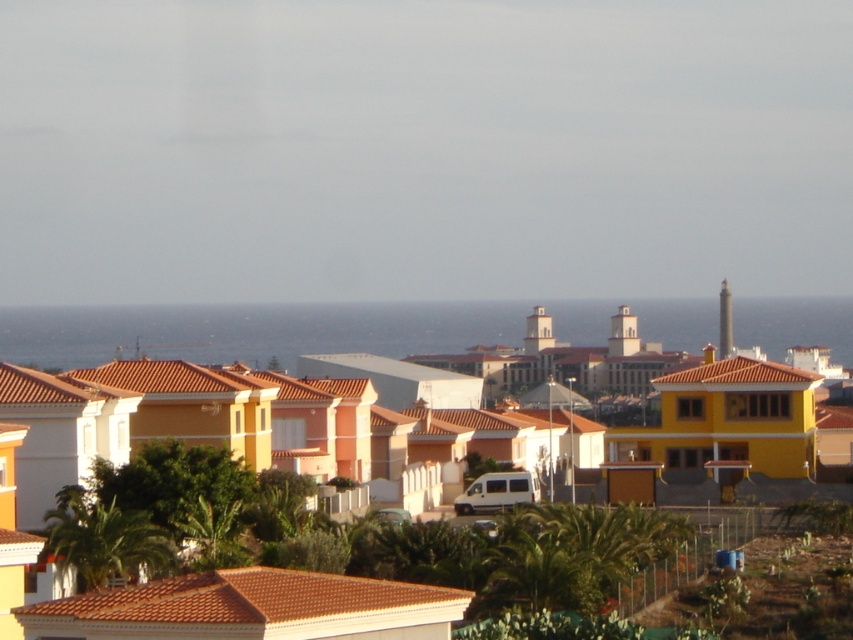
From the picture: You are standing in the coastal residential area and want to take a photo of both the green leafy palm tree at lower left and the green leafy palm tree at lower center without any obstruction. Which tree should you position yourself closer to in order to include both in the frame?

You should position yourself closer to the green leafy palm tree at lower left because it is located below the green leafy palm tree at lower center, allowing both to be captured in the frame without obstruction.

You are standing at the edge of the coastal residential area and want to take a photo of the green leafy palm tree at lower left. If your camera has a maximum focus range of 75 meters, will you need to move closer to capture it clearly?

The green leafy palm tree at lower left is 76.05 meters away from the viewer. Since the camera can only focus up to 75 meters, you need to move closer to ensure the tree is within the focus range.

You are a gardener who needs to water two palm trees. The green leafy palm tree at lower left and the green leafy palm tree at lower center are both in your care. If your watering can holds enough water for 10 feet of distance, can you water both trees without needing to refill?

The distance between the green leafy palm tree at lower left and the green leafy palm tree at lower center is 13.64 feet. Since your watering can can cover 10 feet, you would need to refill it after watering one tree before moving to the other.